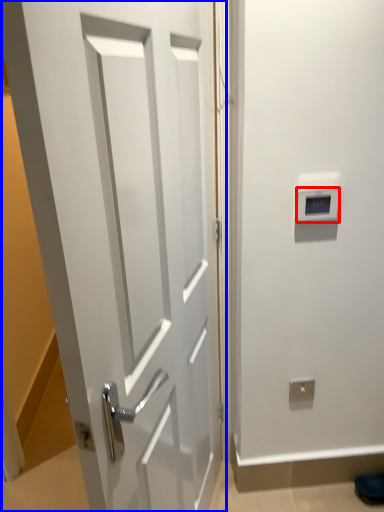
Question: Among these objects, which one is farthest to the camera, thermostat (highlighted by a red box) or door (highlighted by a blue box)?

Choices:
 (A) thermostat
 (B) door

Answer: (A)